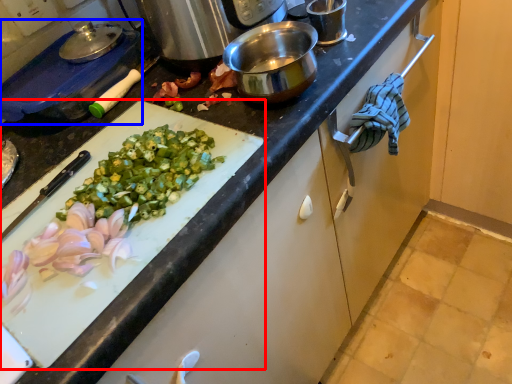
Question: Which object appears closest to the camera in this image, cutting board (highlighted by a red box) or kitchen appliance (highlighted by a blue box)?

Choices:
 (A) cutting board
 (B) kitchen appliance

Answer: (A)